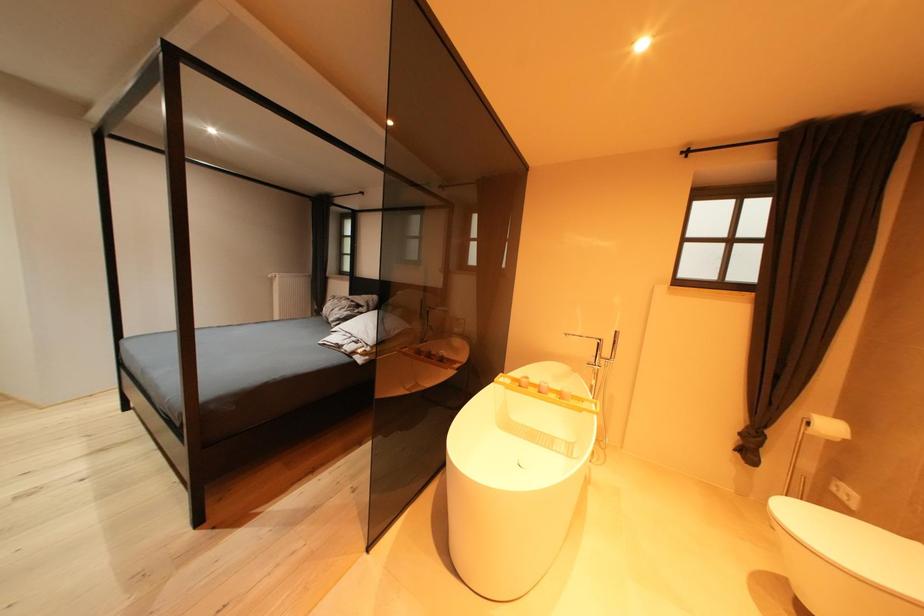
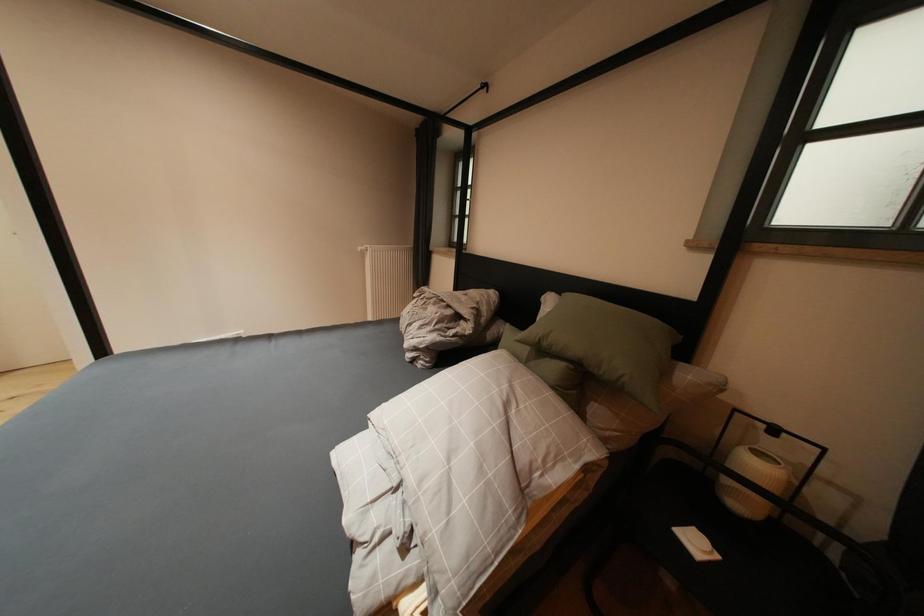
The images are taken continuously from a first-person perspective. In which direction are you moving?

The cameraman walked toward left, forward.